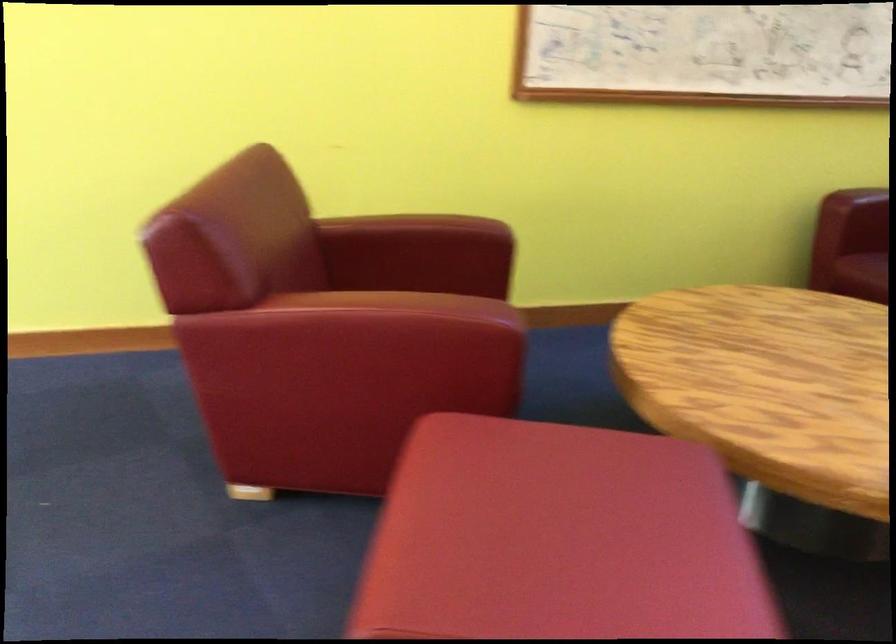
Find where to rest the red chair armrest. Please return your answer as a coordinate pair (x, y).

(356, 301)